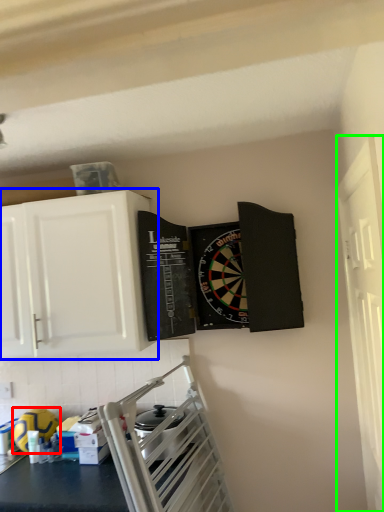
Question: Estimate the real-world distances between objects in this image. Which object is farther from appliance (highlighted by a red box), cabinetry (highlighted by a blue box) or window (highlighted by a green box)?

Choices:
 (A) cabinetry
 (B) window

Answer: (B)